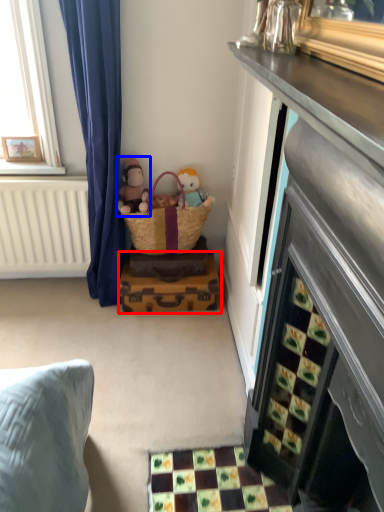
Question: Which object appears closest to the camera in this image, luggage (highlighted by a red box) or doll (highlighted by a blue box)?

Choices:
 (A) luggage
 (B) doll

Answer: (B)